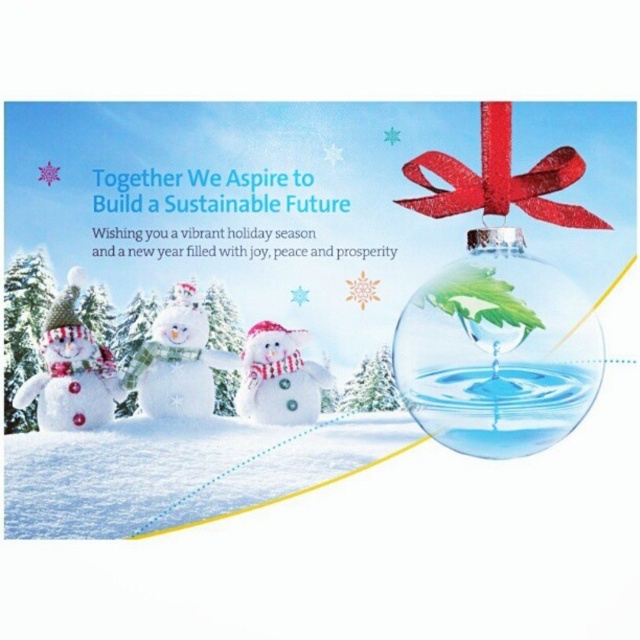
Question: Based on their relative distances, which object is nearer to the white fluffy snow at lower left?

Choices:
 (A) white matte snowman at center
 (B) white fluffy snowman at center

Answer: (B)

Question: Which object is the farthest from the white matte snowman at left?

Choices:
 (A) white matte snowman at center
 (B) white fluffy snowman at center
 (C) white fluffy snow at lower left

Answer: (A)

Question: Among these objects, which one is farthest from the camera?

Choices:
 (A) white fluffy snow at lower left
 (B) white fluffy snowman at center
 (C) white matte snowman at left
 (D) white matte snowman at center

Answer: (D)

Question: Does white fluffy snow at lower left lie behind white matte snowman at left?

Choices:
 (A) no
 (B) yes

Answer: (A)

Question: Is transparent glass ornament at right positioned behind white matte snowman at left?

Choices:
 (A) yes
 (B) no

Answer: (B)

Question: Is transparent glass ornament at right closer to the viewer compared to white matte snowman at left?

Choices:
 (A) yes
 (B) no

Answer: (A)